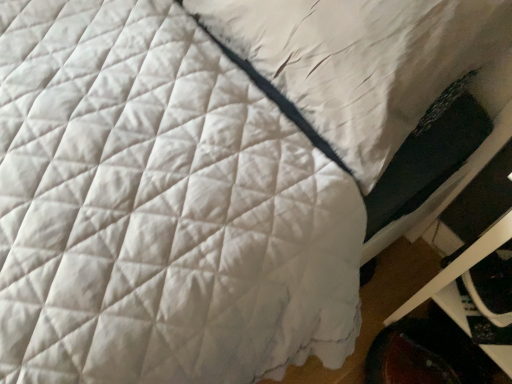
What do you see at coordinates (361, 61) in the screenshot? The height and width of the screenshot is (384, 512). I see `white quilted pillow at center` at bounding box center [361, 61].

Measure the distance between point (467, 36) and camera.

Point (467, 36) and camera are 27.36 inches apart from each other.

This screenshot has height=384, width=512. Identify the location of white quilted pillow at center. (361, 61).

Locate an element on the screen. Image resolution: width=512 pixels, height=384 pixels. white quilted pillow at center is located at coordinates (361, 61).